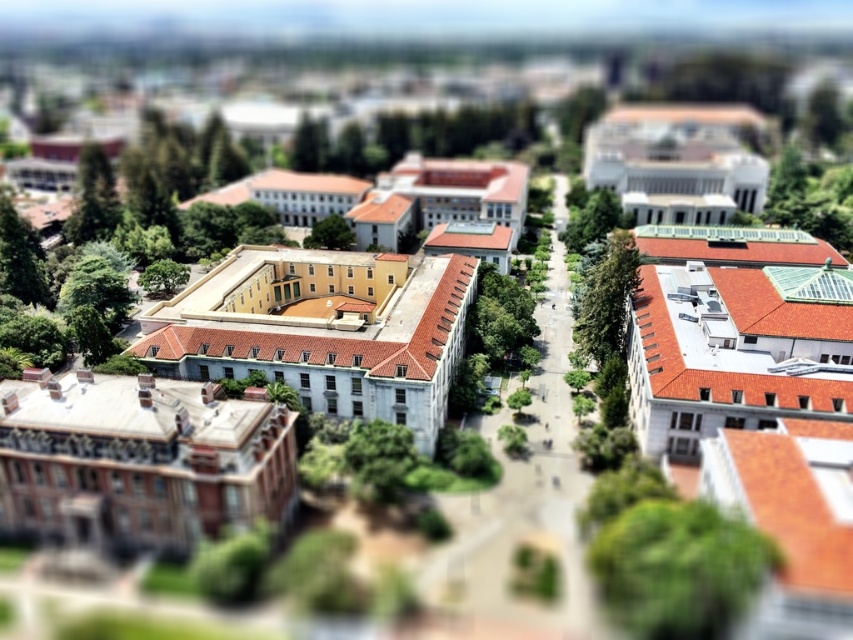
You are a landscape architect planning to install a bench between the green leafy tree at lower right and the green leafy tree at center. What is the minimum distance the bench should be placed from each tree to ensure it is equidistant from both?

The bench should be placed exactly halfway between the green leafy tree at lower right and the green leafy tree at center. Since they are 125.46 meters apart, the midpoint would be at 62.73 meters from each tree.

You are standing at the center of the central building. You see the green leafy tree at lower right. In which direction should you walk to reach it?

Since the green leafy tree at lower right is located at point (x=677, y=566), you should walk towards the lower right direction to reach it.